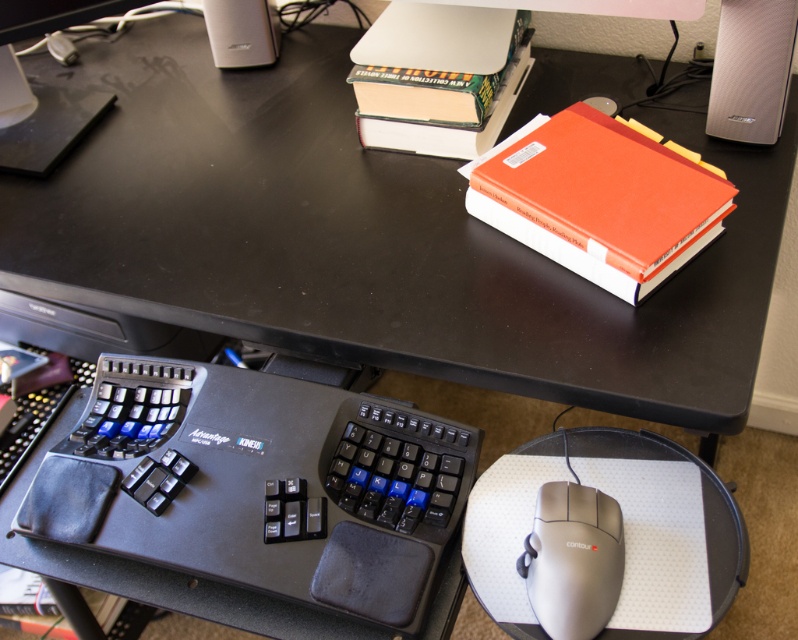
You are a delivery person who just arrived at the office. You need to place a package on the desk. The package is 10 cm in length. The desk has a smooth surface. Where on the desk should you place the package so that it doesn not interfere with the black rubberized keyboard at lower left?

The black rubberized keyboard at lower left is located at point (255,500). To avoid interference, place the package away from this coordinate, ensuring there is enough space between the package and the keyboard.

You are organizing items on your desk and want to place a new item between the orange matte book at upper right and the silver textured speaker at upper right. Is there enough space for this new item?

The orange matte book at upper right is to the left of the silver textured speaker at upper right. Since the speaker is positioned to the right of the book, there is space between them for placing the new item.

You are organizing items on a desk and need to place a new item at point (599, 198). What object is currently at that location?

The orange matte book at upper right is located at point (599, 198).